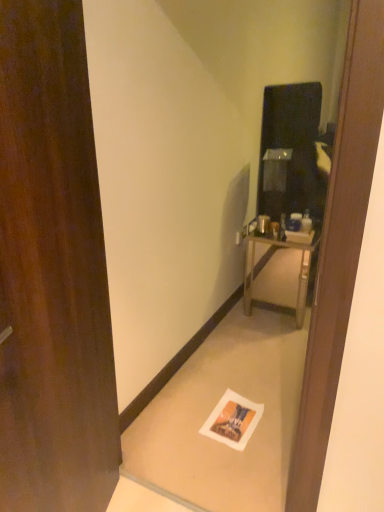
Question: Is brown wood door at left to the left of white paper at lower center from the viewer's perspective?

Choices:
 (A) no
 (B) yes

Answer: (B)

Question: Is brown wood door at left beside white paper at lower center?

Choices:
 (A) no
 (B) yes

Answer: (A)

Question: Is brown wood door at left thinner than white paper at lower center?

Choices:
 (A) yes
 (B) no

Answer: (A)

Question: Does brown wood door at left have a lesser height compared to white paper at lower center?

Choices:
 (A) no
 (B) yes

Answer: (A)

Question: Is brown wood door at left completely or partially outside of white paper at lower center?

Choices:
 (A) yes
 (B) no

Answer: (A)

Question: Does brown wood door at left have a greater width compared to white paper at lower center?

Choices:
 (A) no
 (B) yes

Answer: (A)

Question: Is white paper at lower center taller than metallic silver nightstand at right?

Choices:
 (A) no
 (B) yes

Answer: (A)

Question: Is white paper at lower center not within metallic silver nightstand at right?

Choices:
 (A) yes
 (B) no

Answer: (A)

Question: Does white paper at lower center have a greater width compared to metallic silver nightstand at right?

Choices:
 (A) no
 (B) yes

Answer: (A)

Question: Could you tell me if white paper at lower center is turned towards metallic silver nightstand at right?

Choices:
 (A) no
 (B) yes

Answer: (A)

Question: Could metallic silver nightstand at right be considered to be inside white paper at lower center?

Choices:
 (A) yes
 (B) no

Answer: (B)

Question: From a real-world perspective, is white paper at lower center over metallic silver nightstand at right?

Choices:
 (A) yes
 (B) no

Answer: (B)

Question: Can you confirm if white paper at lower center is thinner than brown wood door at left?

Choices:
 (A) no
 (B) yes

Answer: (A)